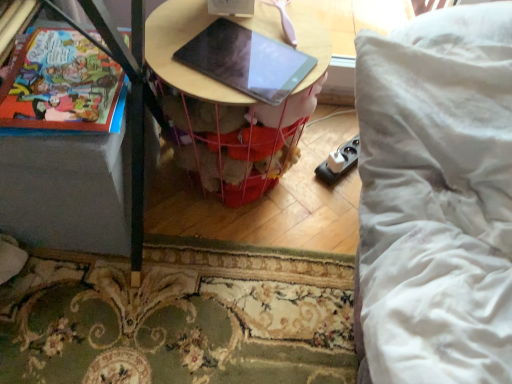
This screenshot has width=512, height=384. I want to click on free spot below matte black tablet at center (from a real-world perspective), so click(x=233, y=66).